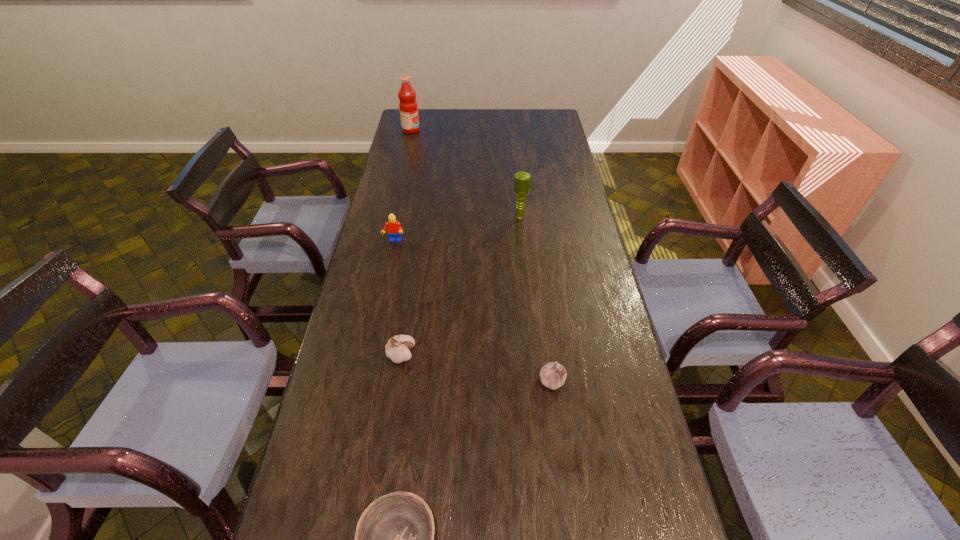
Select which object is the closest to the right garlic. Please provide its 2D coordinates. Your answer should be formatted as a tuple, i.e. [(x, y)], where the tuple contains the x and y coordinates of a point satisfying the conditions above.

[(397, 349)]

Find the location of `object that can be found as the fourth closest to the farther garlic`. object that can be found as the fourth closest to the farther garlic is located at coordinates (521, 179).

Where is `free spot that satisfies the following two spatial constraints: 1. on the front label of the farthest object; 2. on the left side of the fifth farthest object`? This screenshot has width=960, height=540. free spot that satisfies the following two spatial constraints: 1. on the front label of the farthest object; 2. on the left side of the fifth farthest object is located at coordinates (352, 381).

Find the location of a particular element. free space in the image that satisfies the following two spatial constraints: 1. on the front label of the fruit juice; 2. on the right side of the right garlic is located at coordinates (352, 381).

Locate an element on the screen. The image size is (960, 540). vacant space that satisfies the following two spatial constraints: 1. on the front label of the fruit juice; 2. on the back side of the second nearest object is located at coordinates (352, 381).

At what (x,y) coordinates should I click in order to perform the action: click on vacant region that satisfies the following two spatial constraints: 1. on the front label of the tallest object; 2. on the left side of the nearer garlic. Please return your answer as a coordinate pair (x, y). This screenshot has width=960, height=540. Looking at the image, I should click on (352, 381).